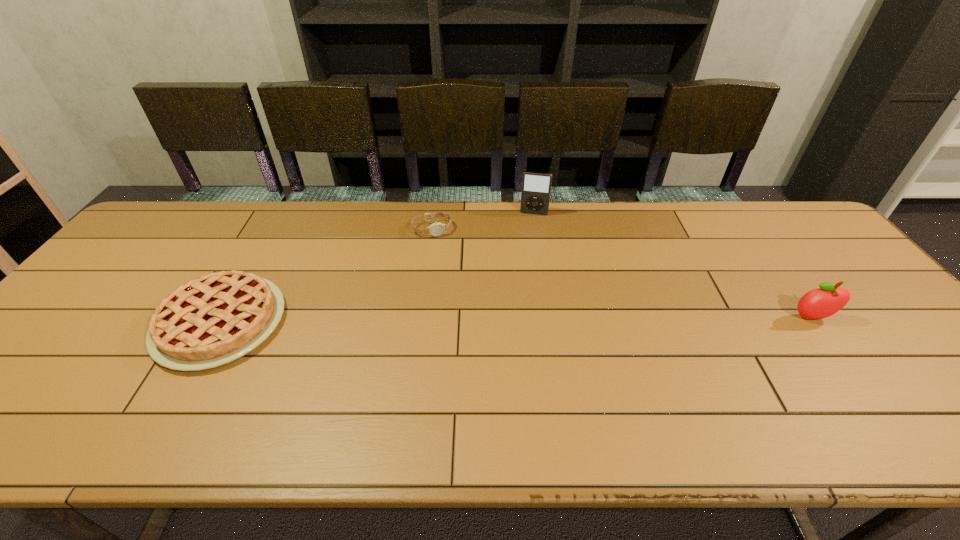
Identify the location of the leftmost object. (210, 321).

Locate an element on the screen. the rightmost object is located at coordinates (819, 303).

Find the location of a particular element. The width and height of the screenshot is (960, 540). the second tallest object is located at coordinates (819, 303).

Where is `watch`? The image size is (960, 540). watch is located at coordinates (436, 229).

At what (x,y) coordinates should I click in order to perform the action: click on the second farthest object. Please return your answer as a coordinate pair (x, y). This screenshot has width=960, height=540. Looking at the image, I should click on (436, 229).

You are a GUI agent. You are given a task and a screenshot of the screen. Output one action in this format:
    pyautogui.click(x=<x>, y=<y>)
    Task: Click on the farthest object
    Image resolution: width=960 pixels, height=540 pixels.
    Given the screenshot: What is the action you would take?
    pyautogui.click(x=536, y=186)

Where is `iPod`? The width and height of the screenshot is (960, 540). iPod is located at coordinates (536, 186).

Where is `free spot located 0.190m on the back of the leftmost object`? Image resolution: width=960 pixels, height=540 pixels. free spot located 0.190m on the back of the leftmost object is located at coordinates (269, 238).

Identify the location of vacant area situated 0.210m on the front-facing side of the third shortest object. (870, 397).

Image resolution: width=960 pixels, height=540 pixels. Identify the location of free space located on the face of the third nearest object. (461, 306).